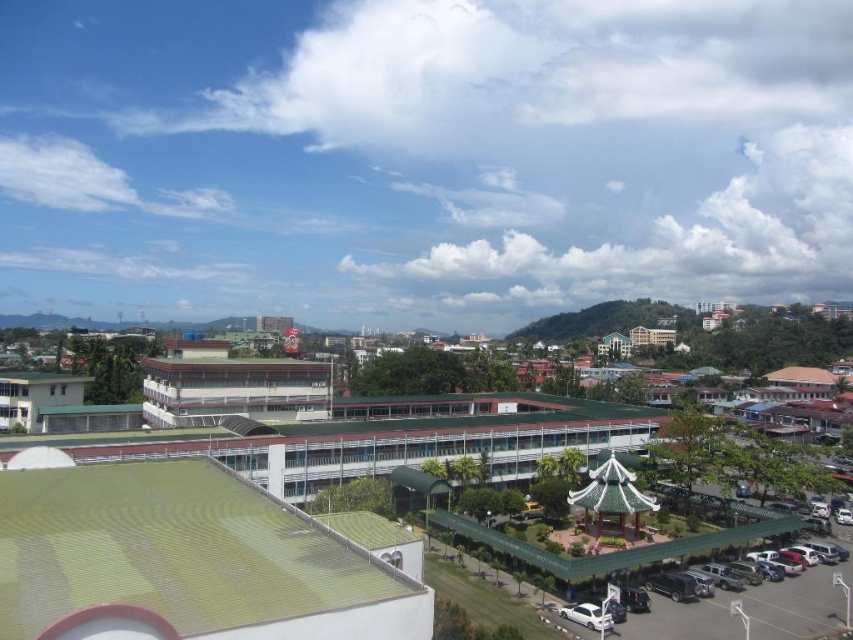
Can you confirm if green metal parking lot at lower right is wider than green textured building at center-right?

Yes.

Is point (720, 616) positioned in front of point (648, 333)?

That is True.

Where is `green metal parking lot at lower right`? This screenshot has height=640, width=853. green metal parking lot at lower right is located at coordinates (750, 611).

Who is taller, white matte building at center or green metal parking lot at lower right?

white matte building at center is taller.

Which of these two, white matte building at center or green metal parking lot at lower right, stands shorter?

Standing shorter between the two is green metal parking lot at lower right.

Image resolution: width=853 pixels, height=640 pixels. Describe the element at coordinates (230, 387) in the screenshot. I see `white matte building at center` at that location.

The image size is (853, 640). Find the location of `white matte building at center`. white matte building at center is located at coordinates (230, 387).

Can you confirm if green metal parking lot at lower right is bigger than white glossy car at lower center?

Yes, green metal parking lot at lower right is bigger than white glossy car at lower center.

Is point (701, 561) more distant than point (601, 621)?

Yes, point (701, 561) is behind point (601, 621).

What are the coordinates of `green metal parking lot at lower right` in the screenshot? It's located at (750, 611).